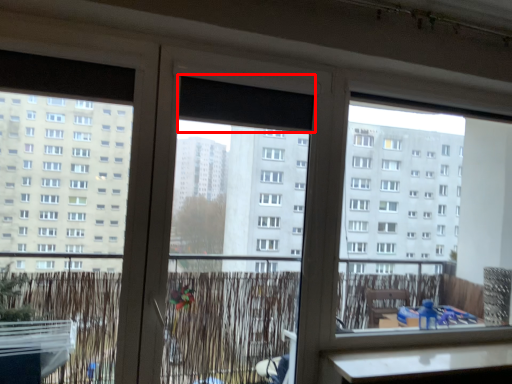
Question: In this image, where is window screen (annotated by the red box) located relative to screen door?

Choices:
 (A) left
 (B) right

Answer: (B)